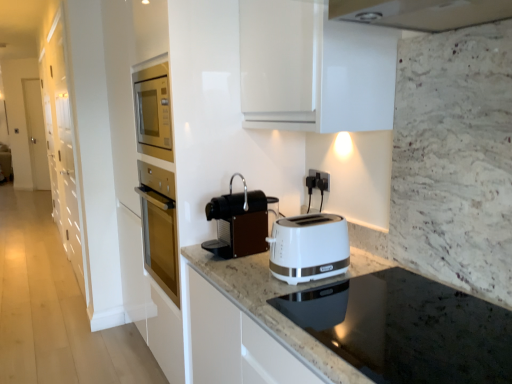
At what (x,y) coordinates should I click in order to perform the action: click on black granite countertop at lower center. Please return your answer as a coordinate pair (x, y). Image resolution: width=512 pixels, height=384 pixels. Looking at the image, I should click on click(371, 321).

You are a GUI agent. You are given a task and a screenshot of the screen. Output one action in this format:
    pyautogui.click(x=<x>, y=<y>)
    Task: Click on the black plastic electrical outlet at center
    The width and height of the screenshot is (512, 384).
    Given the screenshot: What is the action you would take?
    pyautogui.click(x=321, y=176)

Describe the element at coordinates (63, 147) in the screenshot. This screenshot has width=512, height=384. I see `white glossy cabinet at left` at that location.

The image size is (512, 384). Find the location of `black granite countertop at lower center`. black granite countertop at lower center is located at coordinates (371, 321).

Does point (325, 174) come in front of point (65, 30)?

Yes, point (325, 174) is in front of point (65, 30).

From the image's perspective, is black plastic electrical outlet at center located above or below white glossy cabinet at left?

Based on their image positions, black plastic electrical outlet at center is located beneath white glossy cabinet at left.

In the scene shown: From a real-world perspective, which object stands above the other?

black plastic electrical outlet at center, from a real-world perspective.

Where is `cabinetry below the black plastic electrical outlet at center (from a real-world perspective)`? The width and height of the screenshot is (512, 384). cabinetry below the black plastic electrical outlet at center (from a real-world perspective) is located at coordinates [63, 147].

Is white plastic toaster at center not near black granite countertop at lower center?

white plastic toaster at center is actually quite close to black granite countertop at lower center.

Is white plastic toaster at center positioned before black granite countertop at lower center?

No, white plastic toaster at center is behind black granite countertop at lower center.

This screenshot has width=512, height=384. In the image, there is a white plastic toaster at center. Find the location of `countertop below it (from a real-world perspective)`. countertop below it (from a real-world perspective) is located at coordinates (371, 321).

From the picture: Is white plastic toaster at center bigger or smaller than black granite countertop at lower center?

In the image, white plastic toaster at center appears to be smaller than black granite countertop at lower center.

Is white plastic toaster at center far away from brown matte coffee machine at center?

Actually, white plastic toaster at center and brown matte coffee machine at center are a little close together.

Which is nearer, (284,239) or (223,218)?

Point (284,239) is closer to the camera than point (223,218).

From a real-world perspective, is white plastic toaster at center positioned above or below brown matte coffee machine at center?

From a real-world perspective, white plastic toaster at center is physically below brown matte coffee machine at center.

Can you confirm if white plastic toaster at center is wider than brown matte coffee machine at center?

Yes, white plastic toaster at center is wider than brown matte coffee machine at center.

How many degrees apart are the facing directions of white plastic toaster at center and black plastic electrical outlet at center?

2.28 degrees.

Who is shorter, white plastic toaster at center or black plastic electrical outlet at center?

black plastic electrical outlet at center.

How far apart are white plastic toaster at center and black plastic electrical outlet at center?

55.03 centimeters.

Which object is further away from the camera, white plastic toaster at center or black plastic electrical outlet at center?

Positioned behind is black plastic electrical outlet at center.

Which is closer to the camera, (326, 173) or (362, 265)?

The point (362, 265) is in front.

From the picture: Is black plastic electrical outlet at center wider or thinner than black granite countertop at lower center?

Considering their sizes, black plastic electrical outlet at center looks slimmer than black granite countertop at lower center.

Can you confirm if black plastic electrical outlet at center is taller than black granite countertop at lower center?

Correct, black plastic electrical outlet at center is much taller as black granite countertop at lower center.

Can you confirm if black plastic electrical outlet at center is bigger than black granite countertop at lower center?

Incorrect, black plastic electrical outlet at center is not larger than black granite countertop at lower center.

From a real-world perspective, is brown matte coffee machine at center under white glossy cabinet at left?

Indeed, from a real-world perspective, brown matte coffee machine at center is positioned beneath white glossy cabinet at left.

Find the location of a particular element. kitchen appliance that is under the white glossy cabinet at left (from a real-world perspective) is located at coordinates (239, 223).

Is point (222, 236) less distant than point (76, 143)?

That is True.

In order to click on kitchen appliance beneath the black plastic electrical outlet at center (from a real-world perspective) in this screenshot , I will do `click(239, 223)`.

From the image's perspective, which is below, black plastic electrical outlet at center or brown matte coffee machine at center?

brown matte coffee machine at center, from the image's perspective.

Which of these two, black plastic electrical outlet at center or brown matte coffee machine at center, is thinner?

black plastic electrical outlet at center.

Locate an element on the screen. The image size is (512, 384). cabinetry above the black plastic electrical outlet at center (from the image's perspective) is located at coordinates (63, 147).

Find the location of `toaster located behind the black granite countertop at lower center`. toaster located behind the black granite countertop at lower center is located at coordinates (309, 247).

Which object lies nearer to the anchor point black granite countertop at lower center, brown matte coffee machine at center or white plastic toaster at center?

Among the two, white plastic toaster at center is located nearer to black granite countertop at lower center.

Estimate the real-world distances between objects in this image. Which object is further from brown matte coffee machine at center, white plastic toaster at center or white glossy cabinet at left?

Based on the image, white glossy cabinet at left appears to be further to brown matte coffee machine at center.

When comparing their distances from white plastic toaster at center, does black plastic electrical outlet at center or brown matte coffee machine at center seem closer?

brown matte coffee machine at center is positioned closer to the anchor white plastic toaster at center.

Looking at the image, which one is located further to white glossy cabinet at left, black granite countertop at lower center or black plastic electrical outlet at center?

black plastic electrical outlet at center lies further to white glossy cabinet at left than the other object.

From the image, which object appears to be nearer to white glossy cabinet at left, brown matte coffee machine at center or black plastic electrical outlet at center?

The object closer to white glossy cabinet at left is brown matte coffee machine at center.

Based on the photo, considering their positions, is black plastic electrical outlet at center positioned further to white plastic toaster at center than white glossy cabinet at left?

white glossy cabinet at left is positioned further to the anchor white plastic toaster at center.

Estimate the real-world distances between objects in this image. Which object is closer to brown matte coffee machine at center, white glossy cabinet at left or black granite countertop at lower center?

Based on the image, black granite countertop at lower center appears to be nearer to brown matte coffee machine at center.

Considering their positions, is black granite countertop at lower center positioned further to brown matte coffee machine at center than white glossy cabinet at left?

Among the two, white glossy cabinet at left is located further to brown matte coffee machine at center.

At what (x,y) coordinates should I click in order to perform the action: click on toaster between black granite countertop at lower center and brown matte coffee machine at center from front to back. Please return your answer as a coordinate pair (x, y). Looking at the image, I should click on (309, 247).

Where is `electric outlet between white glossy cabinet at left and black granite countertop at lower center from left to right`? The width and height of the screenshot is (512, 384). electric outlet between white glossy cabinet at left and black granite countertop at lower center from left to right is located at coordinates (321, 176).

Where is `kitchen appliance located between white glossy cabinet at left and black granite countertop at lower center in the left-right direction`? The width and height of the screenshot is (512, 384). kitchen appliance located between white glossy cabinet at left and black granite countertop at lower center in the left-right direction is located at coordinates (239, 223).

The height and width of the screenshot is (384, 512). What are the coordinates of `toaster located between white glossy cabinet at left and black plastic electrical outlet at center in the left-right direction` in the screenshot? It's located at (309, 247).